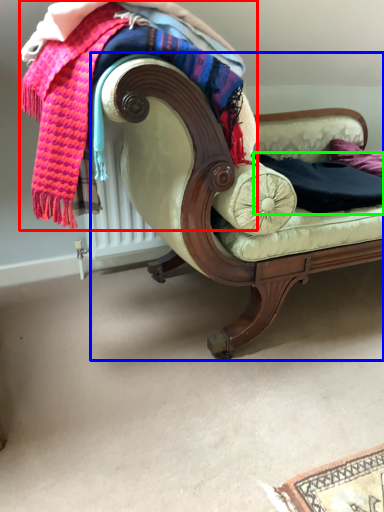
Question: Estimate the real-world distances between objects in this image. Which object is farther from laundry (highlighted by a red box), studio couch (highlighted by a blue box) or clothing (highlighted by a green box)?

Choices:
 (A) studio couch
 (B) clothing

Answer: (B)